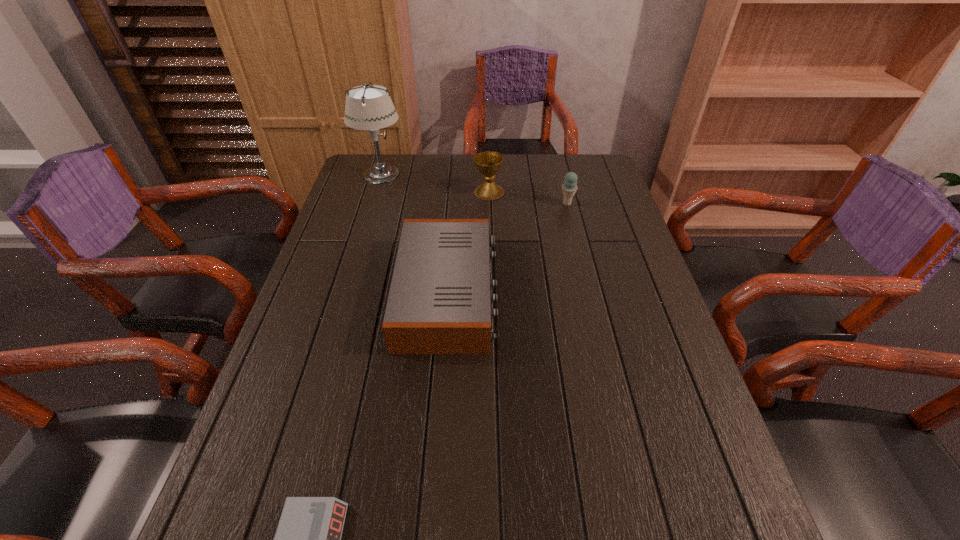
Locate an element on the screen. The image size is (960, 540). chalice located in the far edge section of the desktop is located at coordinates (488, 164).

At what (x,y) coordinates should I click in order to perform the action: click on object situated at the left edge. Please return your answer as a coordinate pair (x, y). This screenshot has height=540, width=960. Looking at the image, I should click on (369, 107).

At what (x,y) coordinates should I click in order to perform the action: click on object present at the right edge. Please return your answer as a coordinate pair (x, y). The width and height of the screenshot is (960, 540). Looking at the image, I should click on (569, 188).

Identify the location of object present at the far left corner. Image resolution: width=960 pixels, height=540 pixels. [369, 107].

At what (x,y) coordinates should I click in order to perform the action: click on vacant space at the left edge. Please return your answer as a coordinate pair (x, y). This screenshot has width=960, height=540. Looking at the image, I should click on (x=244, y=521).

Find the location of a particular element. This screenshot has height=540, width=960. vacant position at the right edge of the desktop is located at coordinates (588, 198).

Image resolution: width=960 pixels, height=540 pixels. Identify the location of vacant region at the far right corner of the desktop. (586, 154).

Find the location of `unoccupied area between the chalice and the rightmost object`. unoccupied area between the chalice and the rightmost object is located at coordinates (528, 198).

This screenshot has height=540, width=960. I want to click on empty space that is in between the chalice and the tallest object, so click(435, 183).

This screenshot has height=540, width=960. Find the location of `vacant space that's between the radio receiver and the rightmost object`. vacant space that's between the radio receiver and the rightmost object is located at coordinates (508, 248).